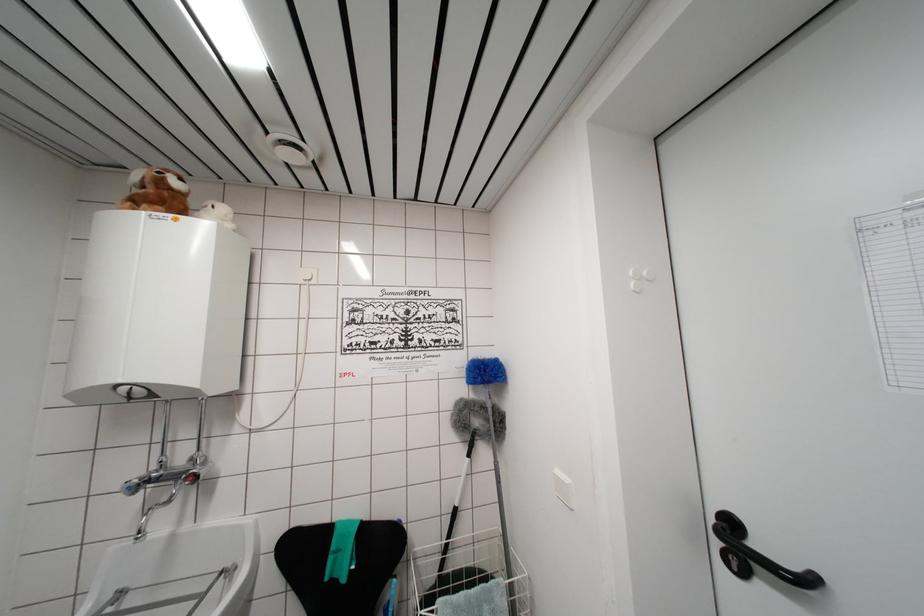
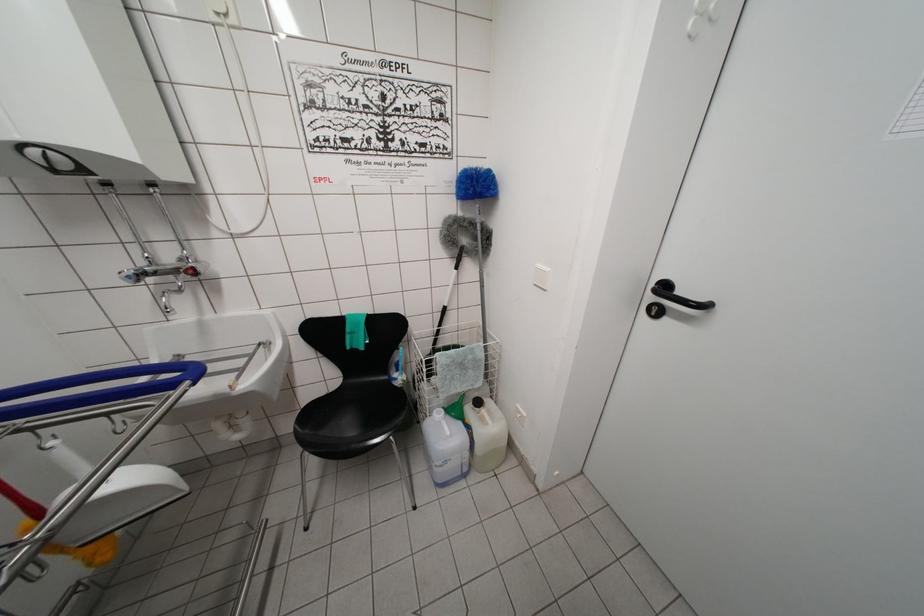
The point at (132, 493) is marked in the first image. Where is the corresponding point in the second image?

(131, 282)